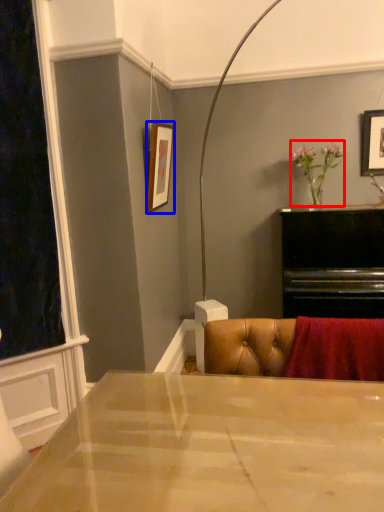
Question: Which of the following is the farthest to the observer, floral arrangement (highlighted by a red box) or picture frame (highlighted by a blue box)?

Choices:
 (A) floral arrangement
 (B) picture frame

Answer: (A)